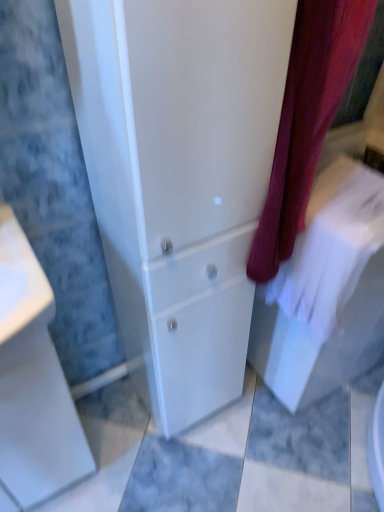
Locate an element on the screen. empty space that is to the right of white glossy cabinet at center is located at coordinates (259, 428).